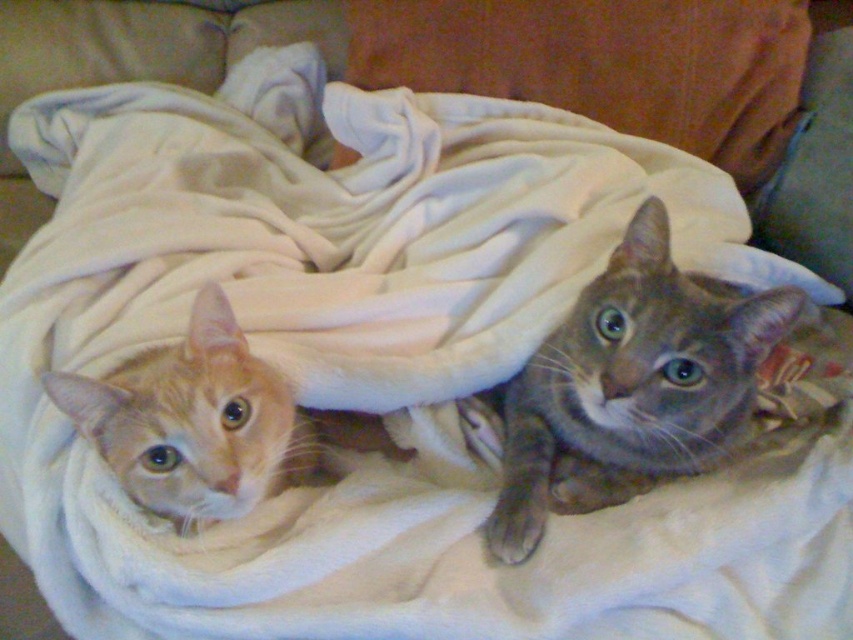
Question: Among these objects, which one is nearest to the camera?

Choices:
 (A) orange fur cat at left
 (B) gray fur cat at center
 (C) gray soft fur cat at upper right

Answer: (A)

Question: Does gray soft fur cat at upper right have a greater width compared to gray fur cat at center?

Choices:
 (A) no
 (B) yes

Answer: (B)

Question: Can you confirm if gray soft fur cat at upper right is thinner than gray fur cat at center?

Choices:
 (A) no
 (B) yes

Answer: (A)

Question: Which point is closer to the camera?

Choices:
 (A) (666, 372)
 (B) (782, 170)
 (C) (186, 433)

Answer: (C)

Question: Which object appears closest to the camera in this image?

Choices:
 (A) gray fur cat at center
 (B) orange fur cat at left

Answer: (B)

Question: Can you confirm if gray soft fur cat at upper right is thinner than gray fur cat at center?

Choices:
 (A) no
 (B) yes

Answer: (A)